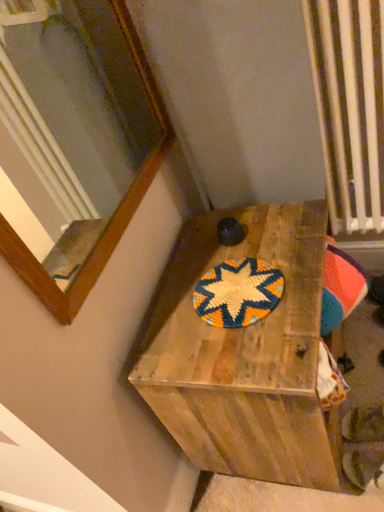
Where is `vacant location behind brightly woven mat at center`? The image size is (384, 512). vacant location behind brightly woven mat at center is located at coordinates (216, 248).